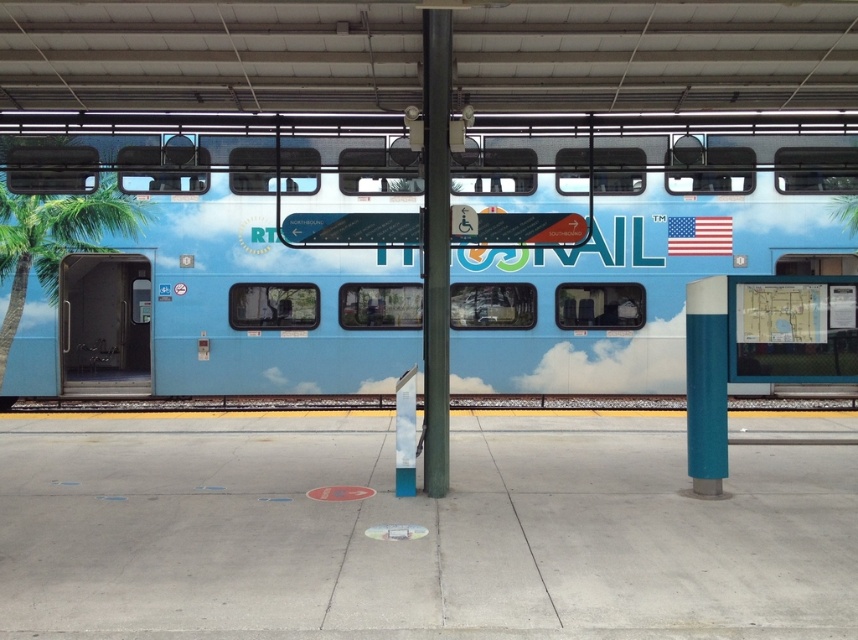
Question: Is light blue glossy train at center positioned in front of green leafy palm tree at left?

Choices:
 (A) no
 (B) yes

Answer: (B)

Question: Among these objects, which one is nearest to the camera?

Choices:
 (A) light blue glossy train at center
 (B) green leafy palm tree at left
 (C) green painted metal pole at center

Answer: (C)

Question: Which point appears closest to the camera in this image?

Choices:
 (A) (426, 109)
 (B) (733, 272)

Answer: (A)

Question: Can you confirm if light blue glossy train at center is positioned to the right of green leafy palm tree at left?

Choices:
 (A) no
 (B) yes

Answer: (B)

Question: Observing the image, what is the correct spatial positioning of light blue glossy train at center in reference to green painted metal pole at center?

Choices:
 (A) right
 (B) left

Answer: (B)

Question: Which point is farther to the camera?

Choices:
 (A) (432, 241)
 (B) (20, 243)

Answer: (B)